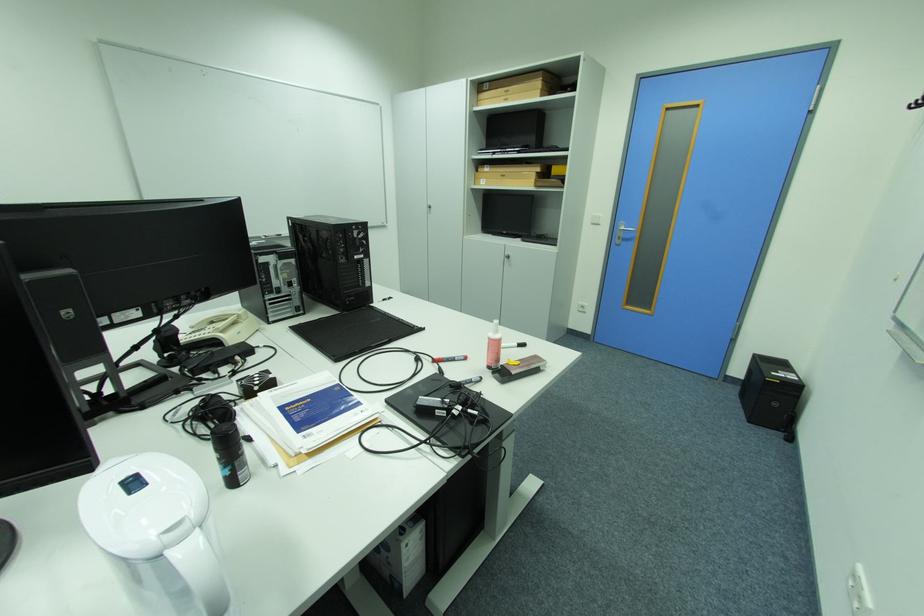
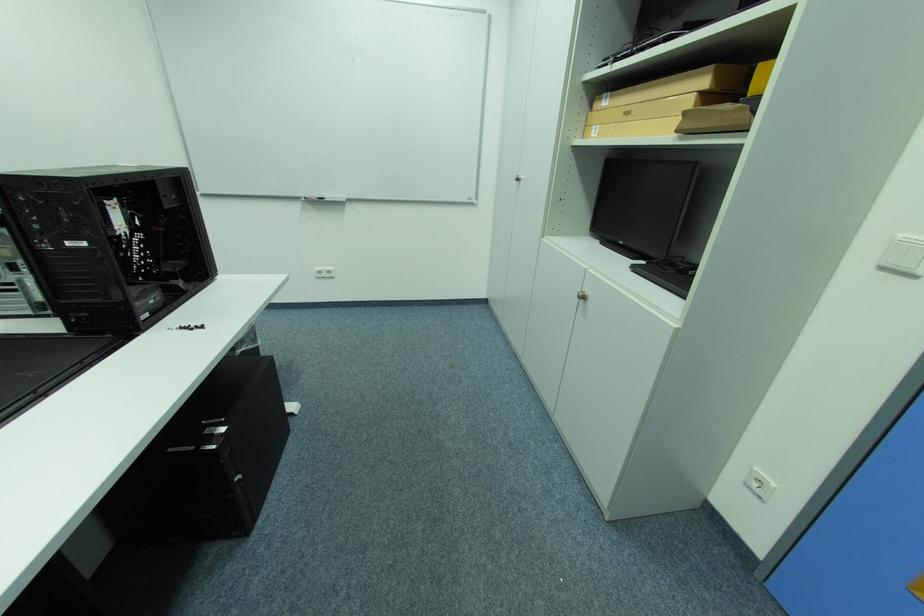
Where in the second image is the point corresponding to (602,215) from the first image?

(907, 236)